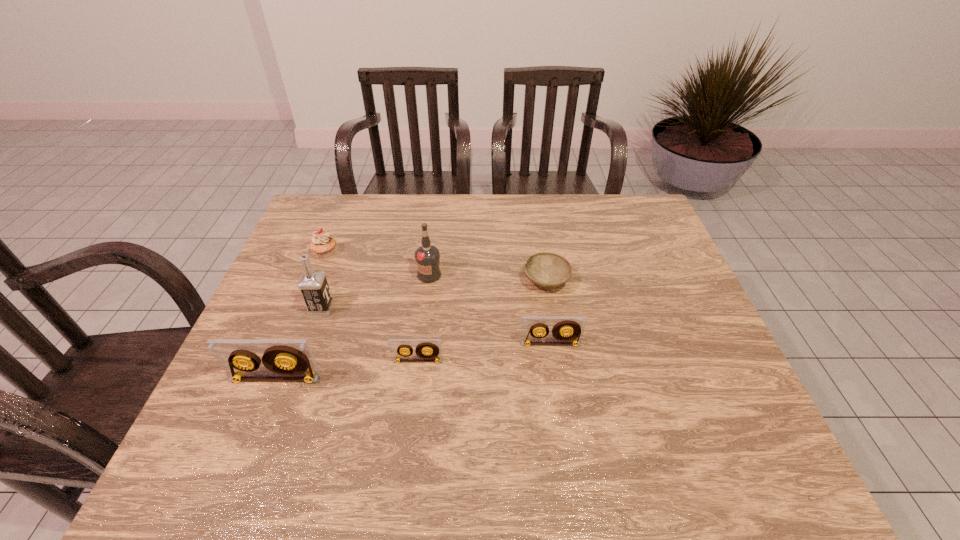
With all videotapes evenly spaced, where should an extra videotape be placed on the right to continue the pattern? Please point out a vacant space. Please provide its 2D coordinates. Your answer should be formatted as a tuple, i.e. [(x, y)], where the tuple contains the x and y coordinates of a point satisfying the conditions above.

[(674, 328)]